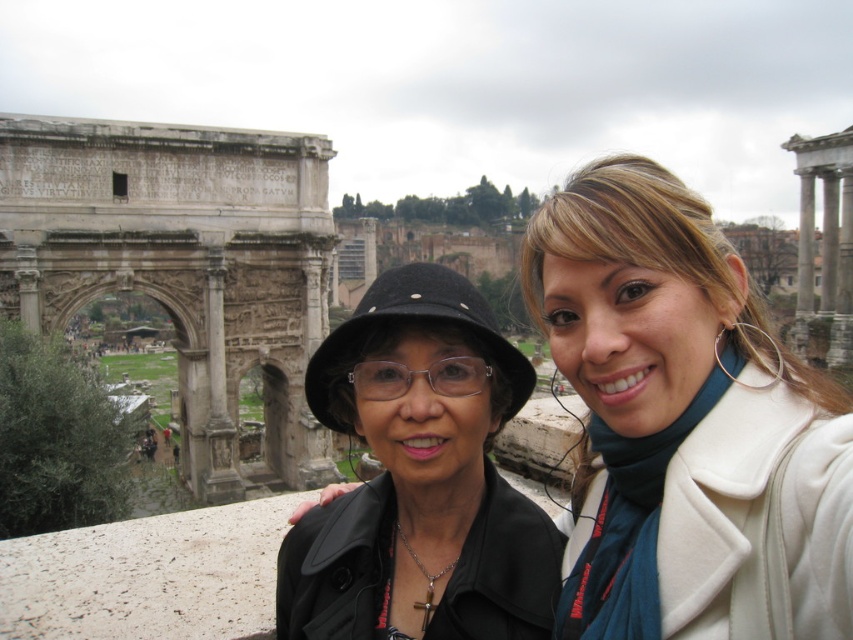
Is matte black hat at center bigger than black matte hat at center?

Correct, matte black hat at center is larger in size than black matte hat at center.

I want to click on matte black hat at center, so click(685, 426).